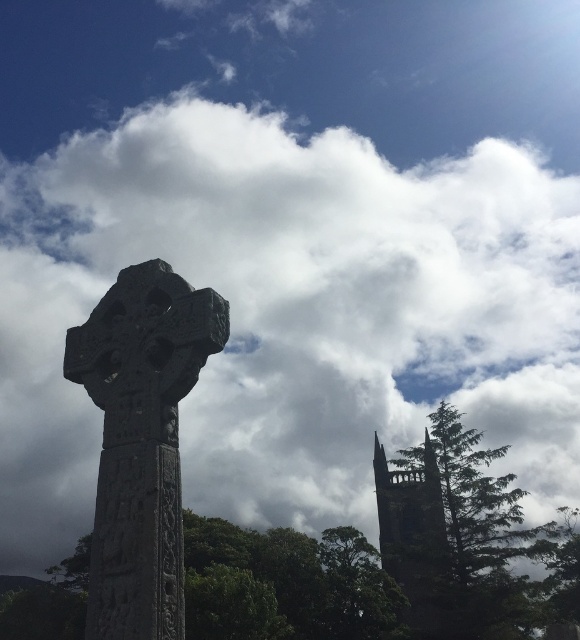
Which is behind, point (324, 531) or point (448, 612)?

Point (324, 531)

Does point (523, 541) come closer to viewer compared to point (378, 445)?

Yes.

Which is in front, point (568, 556) or point (396, 518)?

Point (568, 556)

Find the location of `green textured tree at center`. green textured tree at center is located at coordinates (288, 584).